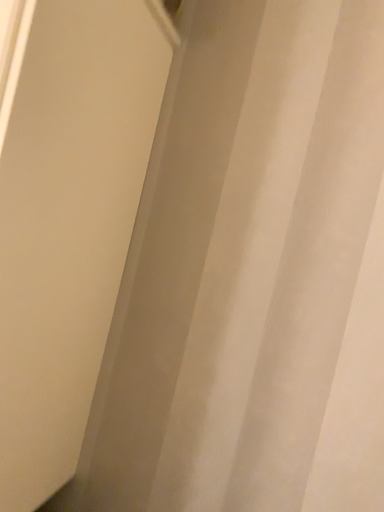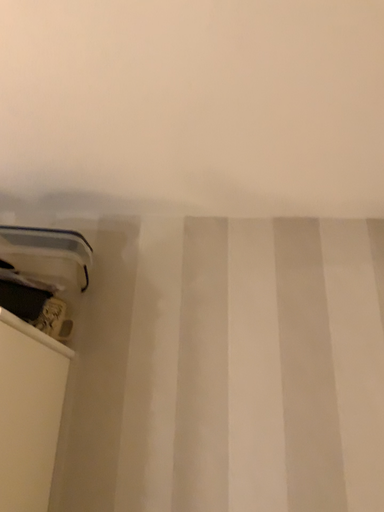
Question: Which way did the camera rotate in the video?

Choices:
 (A) rotated downward
 (B) rotated upward

Answer: (B)